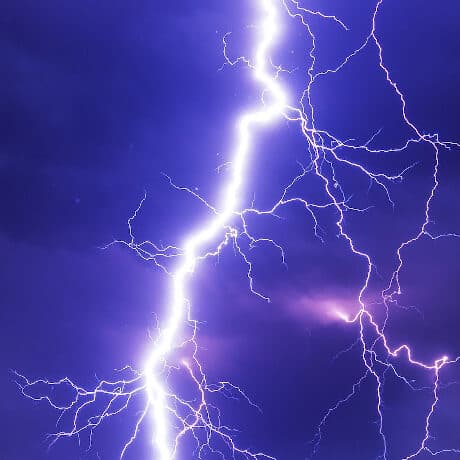
You are a GUI agent. You are given a task and a screenshot of the screen. Output one action in this format:
    pyautogui.click(x=<x>, y=<y>)
    Task: Click on the bright light
    Image resolution: width=460 pixels, height=460 pixels.
    Given the screenshot: What is the action you would take?
    pyautogui.click(x=238, y=171)